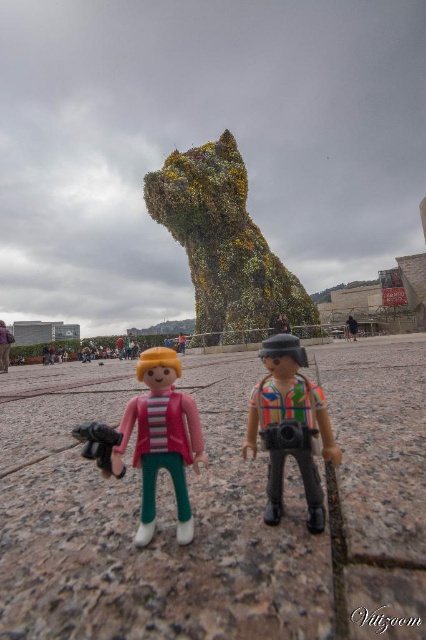
Between point (264, 285) and point (172, 428), which one is positioned in front?

Point (172, 428) is in front.

Where is `green leafy sculpture at center`? Image resolution: width=426 pixels, height=640 pixels. green leafy sculpture at center is located at coordinates pyautogui.click(x=222, y=241).

Is green leafy sculpture at center in front of multicolored fabric camera at center?

No, it is not.

Who is more distant from viewer, (x=218, y=257) or (x=261, y=412)?

Positioned behind is point (x=218, y=257).

This screenshot has height=640, width=426. Identify the location of green leafy sculpture at center. (222, 241).

Between point (141, 449) and point (350, 326), which one is positioned behind?

Positioned behind is point (350, 326).

Based on the photo, can you confirm if pink plastic figure at center is bigger than multicolored striped shirt at center?

No, pink plastic figure at center is not bigger than multicolored striped shirt at center.

This screenshot has height=640, width=426. Describe the element at coordinates (161, 440) in the screenshot. I see `pink plastic figure at center` at that location.

At what (x,y) coordinates should I click in order to perform the action: click on pink plastic figure at center. Please return your answer as a coordinate pair (x, y). Looking at the image, I should click on (161, 440).